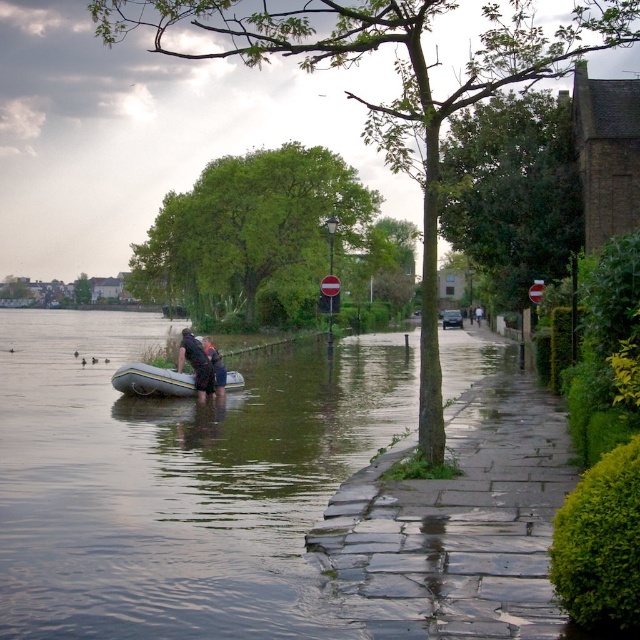
You are a drone operator trying to capture aerial footage of the flooded area. You notice two points marked on your screen at coordinates point (236, 385) and point (216, 364). Which point is closer to your drone camera?

Point (216, 364) is closer to the drone camera because it is less further than point (236, 385), which is positioned further away from the camera.

You are a rescue worker trying to navigate a flooded area. You see the yellow rubber raft at lower left. Based on its position, can you estimate where it is located in the image using coordinates?

The yellow rubber raft at lower left is located at the 2D coordinates point [152,380].